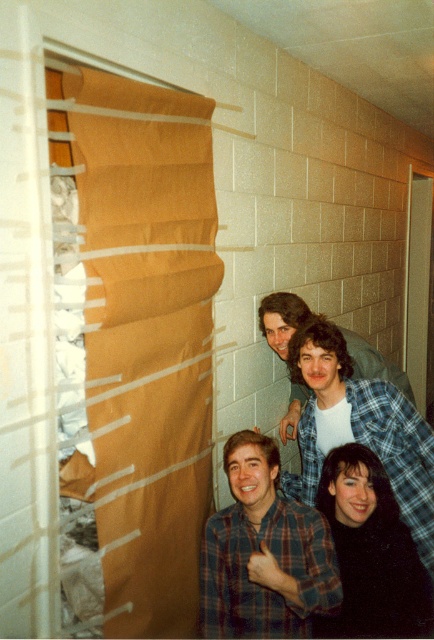
You are a GUI agent. You are given a task and a screenshot of the screen. Output one action in this format:
    pyautogui.click(x=<x>, y=<y>)
    Task: Click on the plaid flannel shirt at lower center
    Image resolution: width=434 pixels, height=640 pixels.
    Given the screenshot: What is the action you would take?
    pyautogui.click(x=263, y=552)

Between plaid flannel shirt at lower center and matte plaid shirt at center, which one has more height?

Standing taller between the two is matte plaid shirt at center.

Which is in front, point (203, 595) or point (286, 429)?

Point (203, 595) is more forward.

Locate an element on the screen. The image size is (434, 640). plaid flannel shirt at lower center is located at coordinates (263, 552).

How much distance is there between plaid flannel shirt at lower center and plaid flannel shirt at center?

plaid flannel shirt at lower center and plaid flannel shirt at center are 39.72 centimeters apart.

The width and height of the screenshot is (434, 640). What do you see at coordinates (263, 552) in the screenshot? I see `plaid flannel shirt at lower center` at bounding box center [263, 552].

Between point (249, 612) and point (326, 321), which one is positioned in front?

Point (249, 612) is more forward.

Identify the location of plaid flannel shirt at lower center. This screenshot has height=640, width=434. (263, 552).

In the scene shown: Which is above, plaid flannel shirt at center or black matte shirt at lower right?

plaid flannel shirt at center is above.

Is plaid flannel shirt at center smaller than black matte shirt at lower right?

Actually, plaid flannel shirt at center might be larger than black matte shirt at lower right.

Which is behind, point (430, 516) or point (410, 588)?

The point (430, 516) is behind.

I want to click on plaid flannel shirt at center, so click(x=361, y=429).